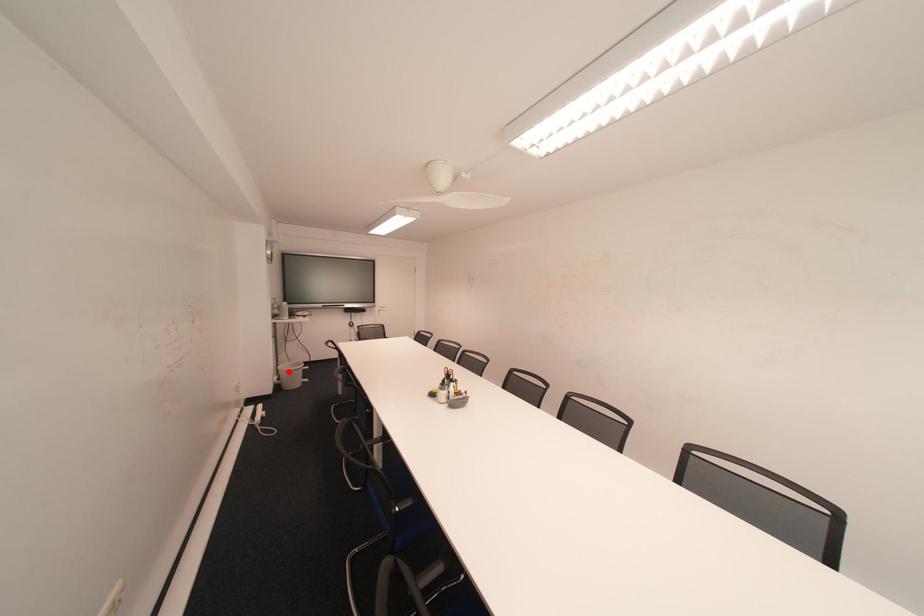
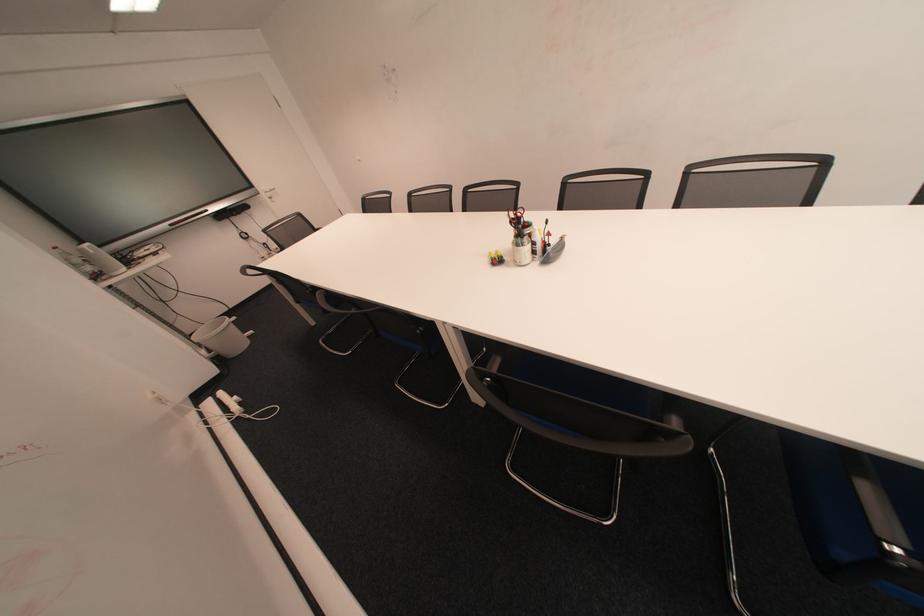
Where in the second image is the point corresponding to the highlighted location from the first image?

(209, 345)